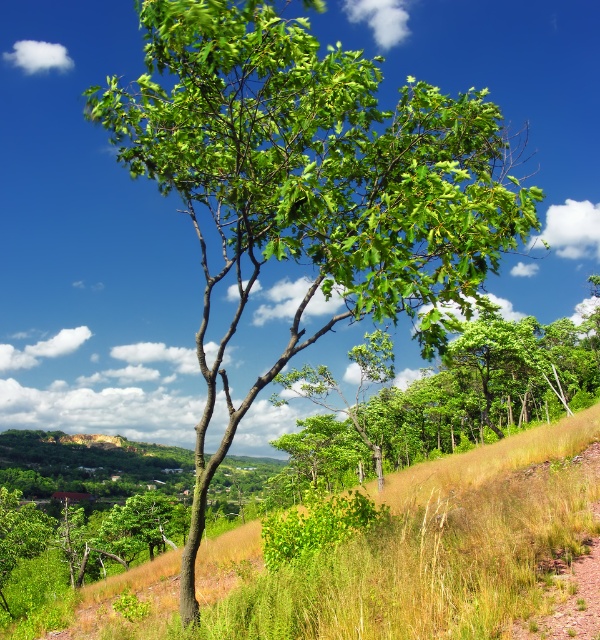
You are standing in the landscape and want to walk to the point closer to you. Which point should you head towards, point (397, 593) or point (387, 401)?

You should head towards point (397, 593) because it is closer to you than point (387, 401).

You are standing at the base of the tree in the foreground. Looking towards the center of the image, you see a point labeled as point (421, 548). What type of terrain feature does this point represent?

The point (421, 548) corresponds to a grassy hillside at center.